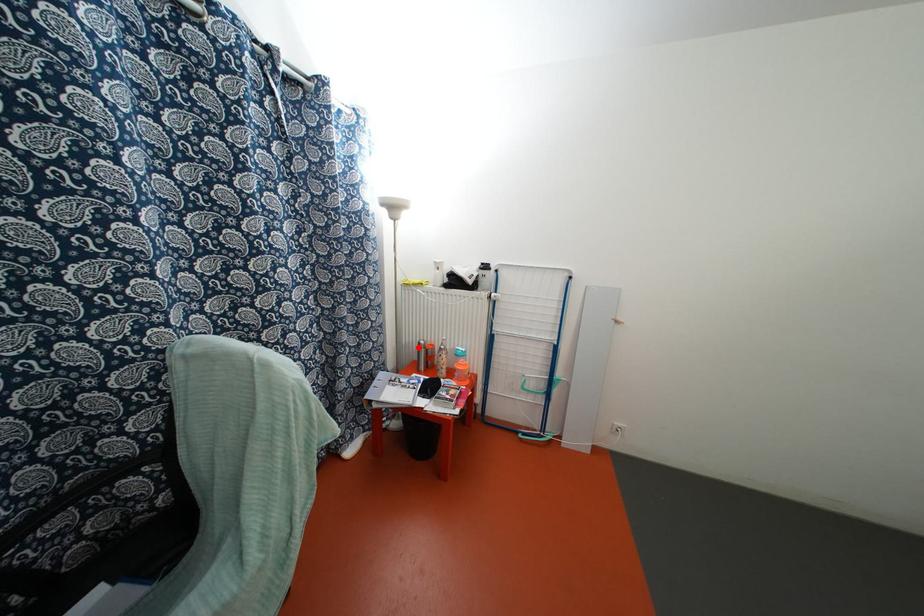
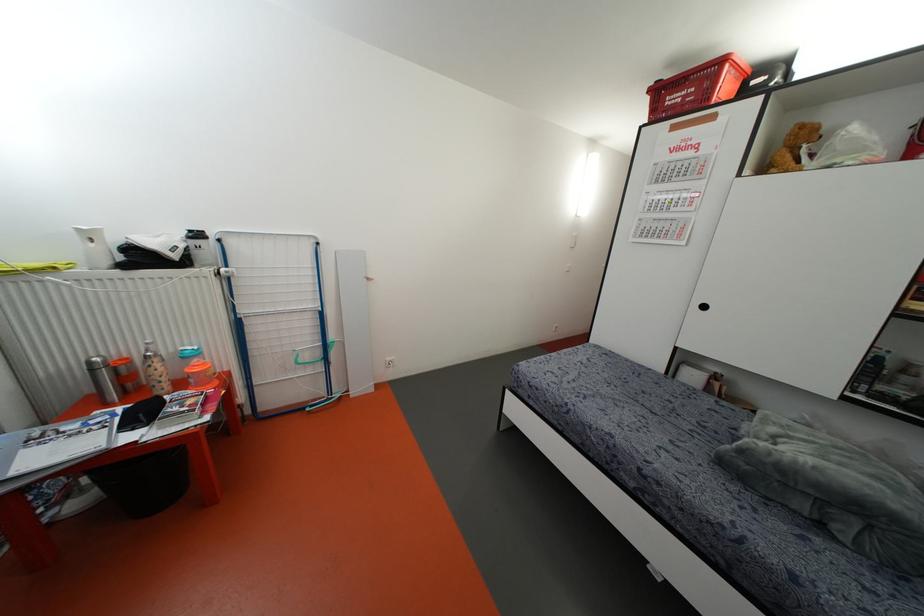
The point at the highlighted location is marked in the first image. Where is the corresponding point in the second image?

(91, 370)